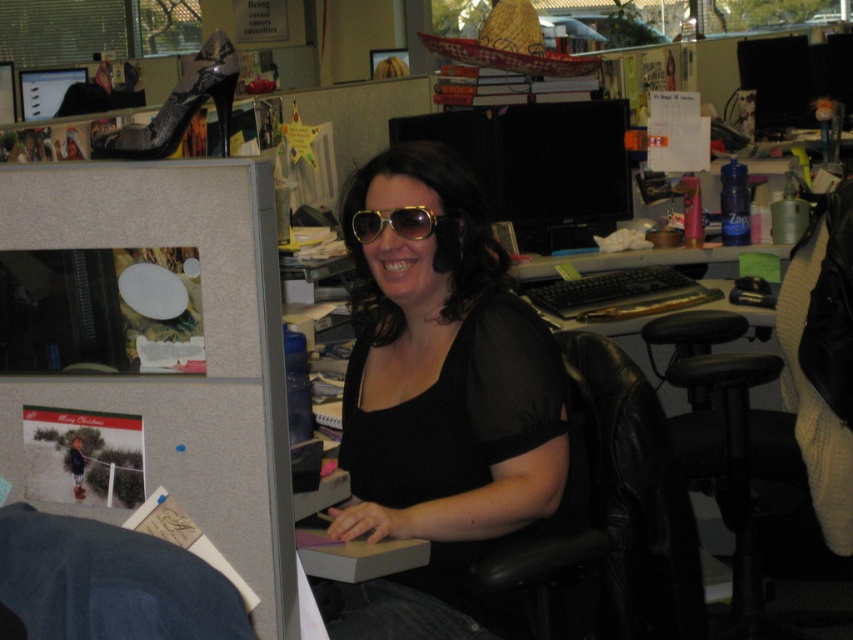
Can you confirm if matte black shirt at center is wider than denim swivel chair at lower left?

Indeed, matte black shirt at center has a greater width compared to denim swivel chair at lower left.

Which is more to the left, matte black shirt at center or denim swivel chair at lower left?

denim swivel chair at lower left

You are a GUI agent. You are given a task and a screenshot of the screen. Output one action in this format:
    pyautogui.click(x=<x>, y=<y>)
    Task: Click on the matte black shirt at center
    This screenshot has height=640, width=853.
    Given the screenshot: What is the action you would take?
    pyautogui.click(x=440, y=406)

Where is `matte black shirt at center`? matte black shirt at center is located at coordinates (440, 406).

Describe the element at coordinates (440, 406) in the screenshot. I see `matte black shirt at center` at that location.

Can you confirm if matte black shirt at center is positioned above black leather chair at center?

Yes.

Is point (549, 387) positioned before point (585, 397)?

Yes, it is.

This screenshot has height=640, width=853. In order to click on matte black shirt at center in this screenshot , I will do `click(440, 406)`.

Consider the image. Can you confirm if black leather chair at center is positioned above gold textured sunglasses at center?

Incorrect, black leather chair at center is not positioned above gold textured sunglasses at center.

Between black leather chair at center and gold textured sunglasses at center, which one has less height?

gold textured sunglasses at center

This screenshot has height=640, width=853. I want to click on black leather chair at center, so click(613, 515).